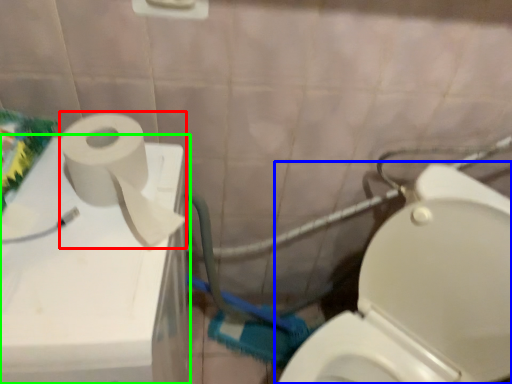
Question: Which object is the closest to the toiletry paper (highlighted by a red box)? Choose among these: toilet (highlighted by a blue box) or appliance (highlighted by a green box).

Choices:
 (A) toilet
 (B) appliance

Answer: (B)